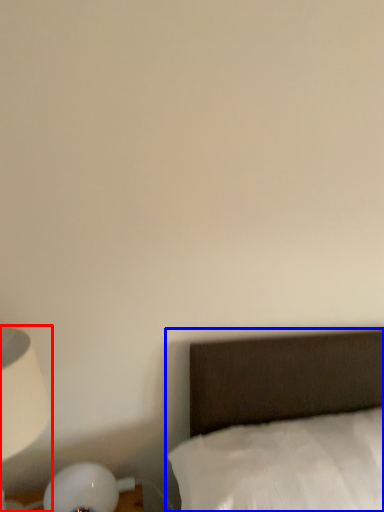
Question: Which point is closer to the camera, lamp (highlighted by a red box) or bed (highlighted by a blue box)?

Choices:
 (A) lamp
 (B) bed

Answer: (B)